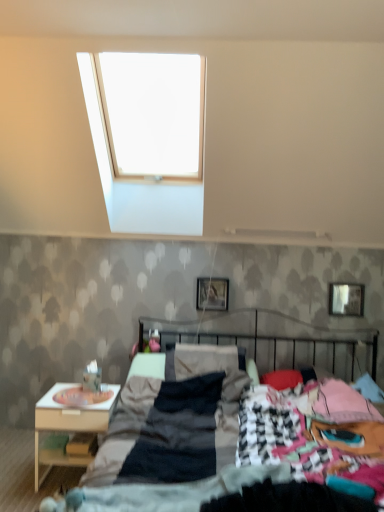
Question: From a real-world perspective, is white wood nightstand at lower left physically below metallic silver picture frame at upper right, which is the second picture frame in left-to-right order?

Choices:
 (A) no
 (B) yes

Answer: (B)

Question: Would you say white wood nightstand at lower left is outside metallic silver picture frame at upper right, which is the second picture frame in left-to-right order?

Choices:
 (A) no
 (B) yes

Answer: (B)

Question: Are white wood nightstand at lower left and metallic silver picture frame at upper right, which is the second picture frame in left-to-right order, making contact?

Choices:
 (A) no
 (B) yes

Answer: (A)

Question: Can you confirm if white wood nightstand at lower left is wider than metallic silver picture frame at upper right, the 1th picture frame viewed from the right?

Choices:
 (A) no
 (B) yes

Answer: (B)

Question: Is white wood nightstand at lower left facing away from metallic silver picture frame at upper right, the 1th picture frame viewed from the right?

Choices:
 (A) no
 (B) yes

Answer: (A)

Question: Could you tell me if white wood nightstand at lower left is facing metallic silver picture frame at upper right, which is the second picture frame in left-to-right order?

Choices:
 (A) yes
 (B) no

Answer: (B)

Question: Does metallic silver picture frame at upper right, which is the second picture frame in left-to-right order, have a larger size compared to white wood nightstand at lower left?

Choices:
 (A) yes
 (B) no

Answer: (B)

Question: Can you confirm if metallic silver picture frame at upper right, which is the second picture frame in left-to-right order, is positioned to the left of white wood nightstand at lower left?

Choices:
 (A) no
 (B) yes

Answer: (A)

Question: Does metallic silver picture frame at upper right, the 1th picture frame viewed from the right, appear on the right side of white wood nightstand at lower left?

Choices:
 (A) yes
 (B) no

Answer: (A)

Question: From the image's perspective, is metallic silver picture frame at upper right, which is the second picture frame in left-to-right order, over white wood nightstand at lower left?

Choices:
 (A) no
 (B) yes

Answer: (B)

Question: Is metallic silver picture frame at upper right, which is the second picture frame in left-to-right order, not inside white wood nightstand at lower left?

Choices:
 (A) yes
 (B) no

Answer: (A)

Question: Is metallic silver picture frame at upper right, which is the second picture frame in left-to-right order, facing away from white wood nightstand at lower left?

Choices:
 (A) no
 (B) yes

Answer: (A)

Question: Can you confirm if dark gray fabric bed at center is thinner than white wood nightstand at lower left?

Choices:
 (A) no
 (B) yes

Answer: (A)